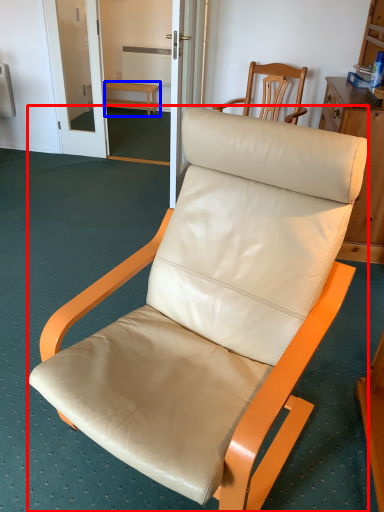
Question: Which object is closer to the camera taking this photo, chair (highlighted by a red box) or furniture (highlighted by a blue box)?

Choices:
 (A) chair
 (B) furniture

Answer: (A)